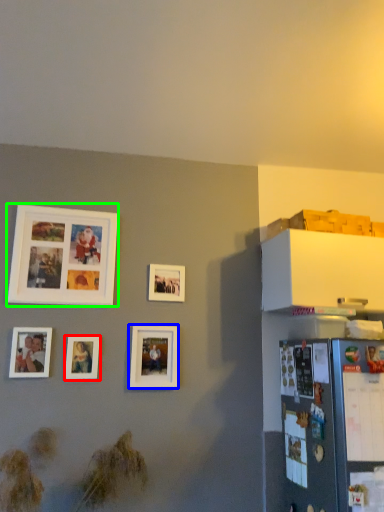
Question: Considering the real-world distances, which object is farthest from picture frame (highlighted by a red box)? picture frame (highlighted by a blue box) or picture frame (highlighted by a green box)?

Choices:
 (A) picture frame
 (B) picture frame

Answer: (B)